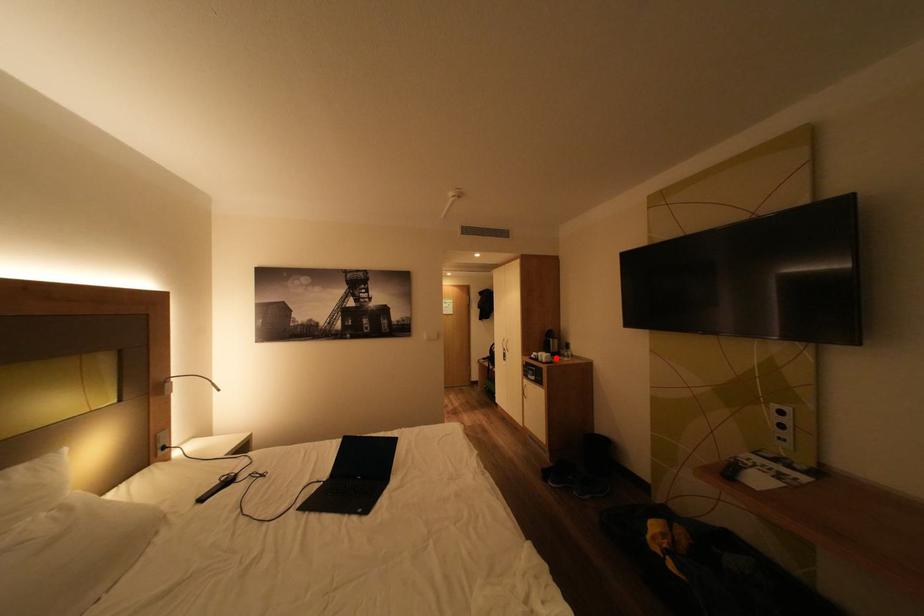
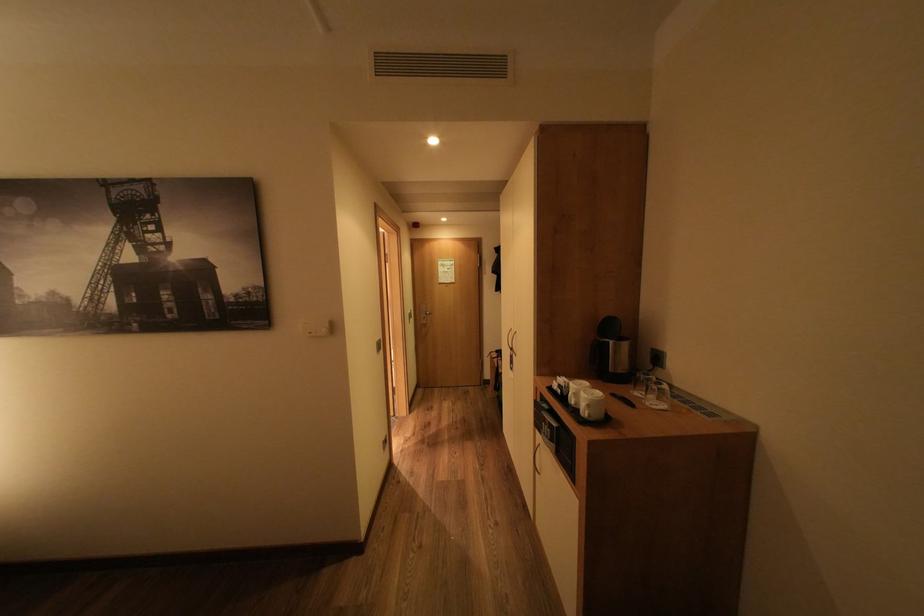
The point at the highlighted location is marked in the first image. Where is the corresponding point in the second image?

(600, 406)